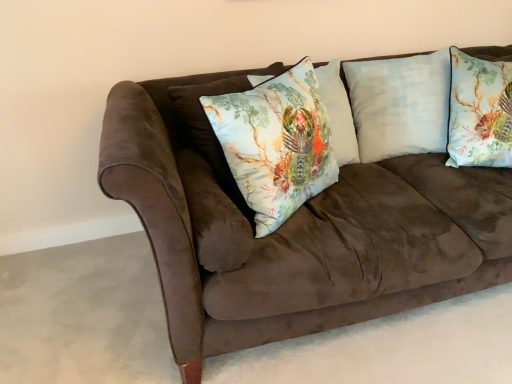
Question: Which direction should I rotate to look at printed fabric pillow at center, arranged as the 2th pillow when viewed from the left, — up or down?

Choices:
 (A) up
 (B) down

Answer: (A)

Question: Considering the relative sizes of printed fabric cushion at center, the 1th pillow from the left, and light blue cotton pillow at upper right, the third pillow from the left, in the image provided, is printed fabric cushion at center, the 1th pillow from the left, smaller than light blue cotton pillow at upper right, the third pillow from the left,?

Choices:
 (A) yes
 (B) no

Answer: (A)

Question: Does printed fabric cushion at center, which is the fourth pillow in right-to-left order, have a greater height compared to light blue cotton pillow at upper right, the third pillow from the left?

Choices:
 (A) no
 (B) yes

Answer: (A)

Question: Is printed fabric cushion at center, which is the fourth pillow in right-to-left order, positioned with its back to light blue cotton pillow at upper right, the second pillow viewed from the right?

Choices:
 (A) no
 (B) yes

Answer: (A)

Question: Considering the relative sizes of printed fabric cushion at center, the 1th pillow from the left, and light blue cotton pillow at upper right, the third pillow from the left, in the image provided, is printed fabric cushion at center, the 1th pillow from the left, bigger than light blue cotton pillow at upper right, the third pillow from the left,?

Choices:
 (A) no
 (B) yes

Answer: (A)

Question: Can you confirm if printed fabric cushion at center, which is the fourth pillow in right-to-left order, is thinner than light blue cotton pillow at upper right, the third pillow from the left?

Choices:
 (A) no
 (B) yes

Answer: (B)

Question: Is printed fabric cushion at center, which is the fourth pillow in right-to-left order, aimed at light blue cotton pillow at upper right, the third pillow from the left?

Choices:
 (A) yes
 (B) no

Answer: (B)

Question: Considering the relative sizes of light blue cotton pillow at upper right, the second pillow viewed from the right, and textured floral pillow at upper right, the fourth pillow when ordered from left to right, in the image provided, is light blue cotton pillow at upper right, the second pillow viewed from the right, taller than textured floral pillow at upper right, the fourth pillow when ordered from left to right,?

Choices:
 (A) yes
 (B) no

Answer: (A)

Question: Is light blue cotton pillow at upper right, the second pillow viewed from the right, further to the viewer compared to textured floral pillow at upper right, the first pillow viewed from the right?

Choices:
 (A) yes
 (B) no

Answer: (A)

Question: Is light blue cotton pillow at upper right, the third pillow from the left, positioned before textured floral pillow at upper right, the fourth pillow when ordered from left to right?

Choices:
 (A) no
 (B) yes

Answer: (A)

Question: Could you tell me if light blue cotton pillow at upper right, the third pillow from the left, is turned towards textured floral pillow at upper right, the first pillow viewed from the right?

Choices:
 (A) yes
 (B) no

Answer: (B)

Question: Is light blue cotton pillow at upper right, the second pillow viewed from the right, wider than textured floral pillow at upper right, the first pillow viewed from the right?

Choices:
 (A) yes
 (B) no

Answer: (B)

Question: Considering the relative sizes of light blue cotton pillow at upper right, the second pillow viewed from the right, and textured floral pillow at upper right, the first pillow viewed from the right, in the image provided, is light blue cotton pillow at upper right, the second pillow viewed from the right, bigger than textured floral pillow at upper right, the first pillow viewed from the right,?

Choices:
 (A) no
 (B) yes

Answer: (B)

Question: Does printed fabric cushion at center, the 1th pillow from the left, appear on the right side of textured floral pillow at upper right, the first pillow viewed from the right?

Choices:
 (A) yes
 (B) no

Answer: (B)